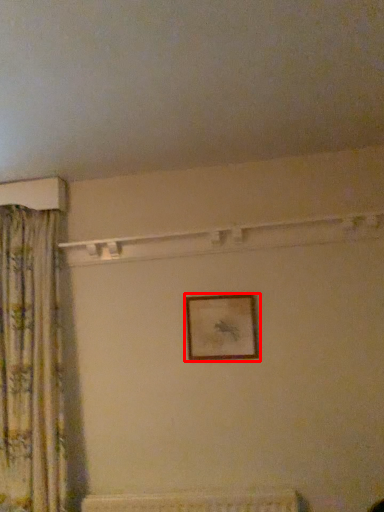
Question: From the image's perspective, what is the correct spatial relationship of picture frame (annotated by the red box) in relation to curtain?

Choices:
 (A) above
 (B) below

Answer: (A)